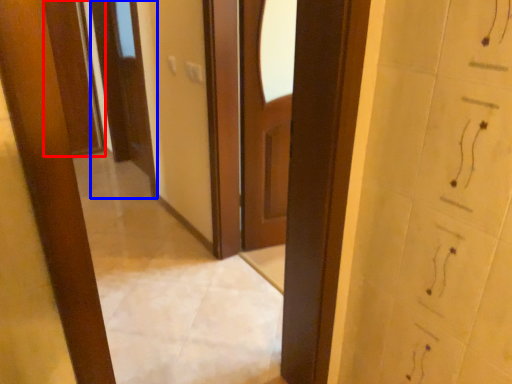
Question: Among these objects, which one is nearest to the camera, door (highlighted by a red box) or door (highlighted by a blue box)?

Choices:
 (A) door
 (B) door

Answer: (B)